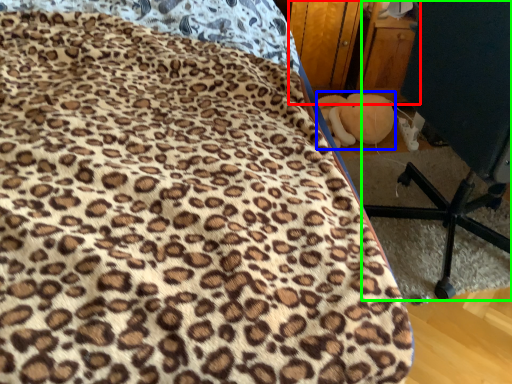
Question: Which object is the closest to the dresser (highlighted by a red box)? Choose among these: toy (highlighted by a blue box) or furniture (highlighted by a green box).

Choices:
 (A) toy
 (B) furniture

Answer: (A)